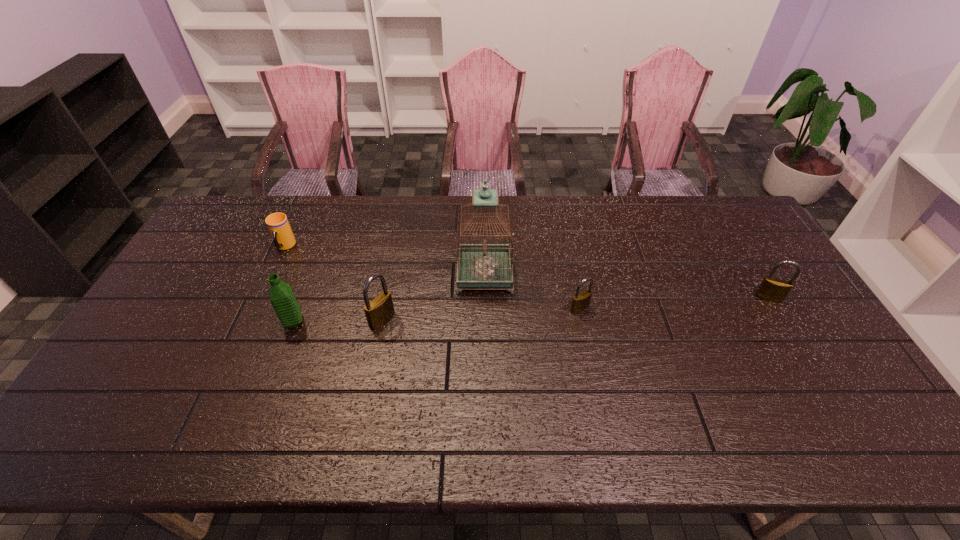
Given the evenly spaced padlocks in the image, where should an extra padlock be added on the left to preserve the spacing? Please point to a vacant space. Please provide its 2D coordinates. Your answer should be formatted as a tuple, i.e. [(x, y)], where the tuple contains the x and y coordinates of a point satisfying the conditions above.

[(176, 332)]